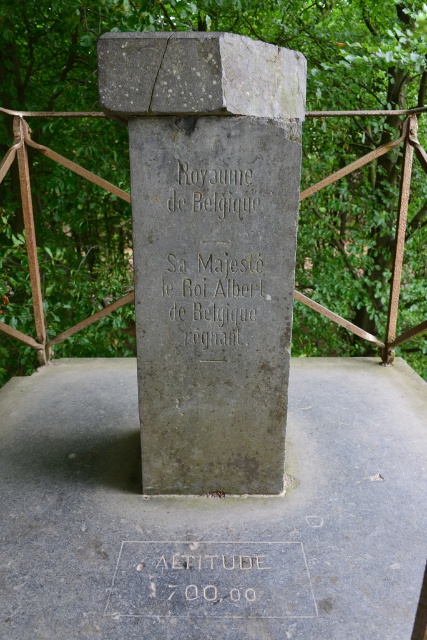
You are a visitor at the monument and want to read the black stone engraving at center. Is the gray concrete at center blocking your view of the engraving?

The gray concrete at center is positioned under the black stone engraving at center, so it is not blocking the view of the engraving since it is located below it.

In the scene shown: You are a historian examining the gray stone monument at center and the etched stone altitude at center. Which object would you need to measure to determine their widths accurately?

You would need to measure both the gray stone monument at center and the etched stone altitude at center to determine which is wider since the description states that the gray stone monument at center might be wider than the etched stone altitude at center.

Looking at this image, what is the relationship between the gray concrete at center and the black stone engraving at center in terms of their spatial positioning?

The gray concrete at center is positioned in front of the black stone engraving at center.